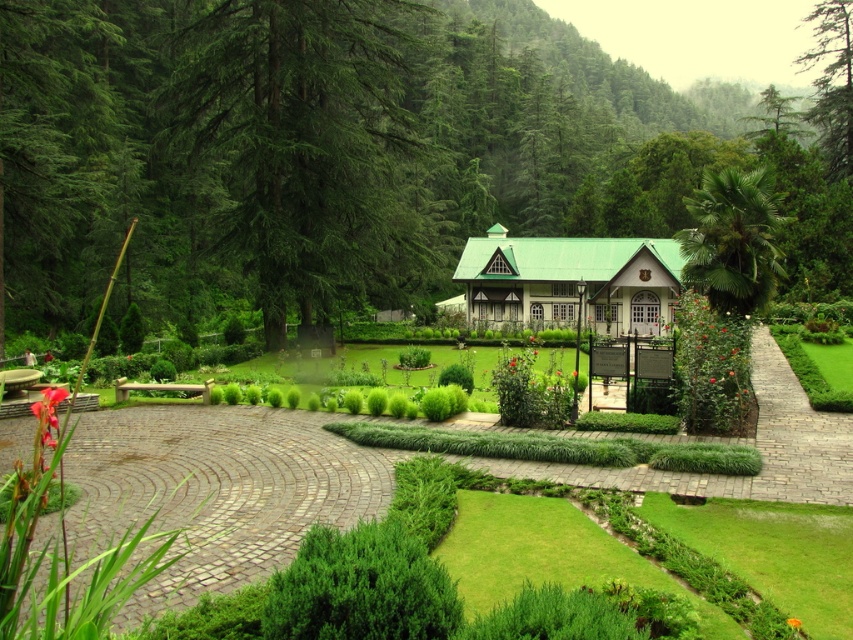
Question: Does green textured tree at upper left come in front of green textured tree at upper right?

Choices:
 (A) yes
 (B) no

Answer: (A)

Question: Estimate the real-world distances between objects in this image. Which object is farther from the green textured tree at upper right?

Choices:
 (A) green wooden cottage at center
 (B) green leafy palm at upper right

Answer: (B)

Question: Observing the image, what is the correct spatial positioning of green wooden cottage at center in reference to green leafy palm at upper right?

Choices:
 (A) below
 (B) above

Answer: (A)

Question: Which of the following is the closest to the observer?

Choices:
 (A) (807, 163)
 (B) (532, 339)
 (C) (517, 296)

Answer: (B)

Question: Which object appears closest to the camera in this image?

Choices:
 (A) green wooden cottage at center
 (B) green textured tree at upper right

Answer: (A)

Question: Is green textured tree at upper right thinner than red matte rose at center?

Choices:
 (A) no
 (B) yes

Answer: (A)